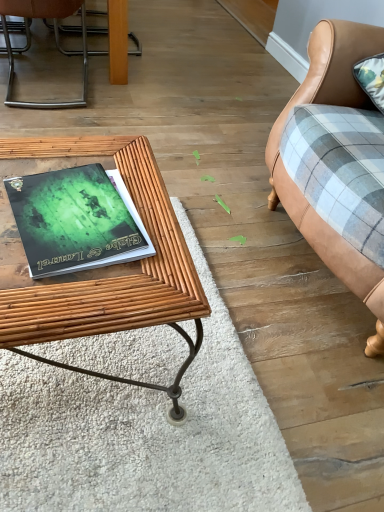
Locate an element on the screen. The height and width of the screenshot is (512, 384). free space behind green matte book at center is located at coordinates (96, 158).